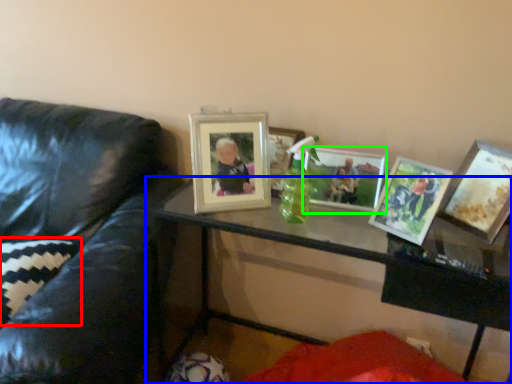
Question: Considering the real-world distances, which object is closest to pillow (highlighted by a red box)? table (highlighted by a blue box) or picture frame (highlighted by a green box).

Choices:
 (A) table
 (B) picture frame

Answer: (A)